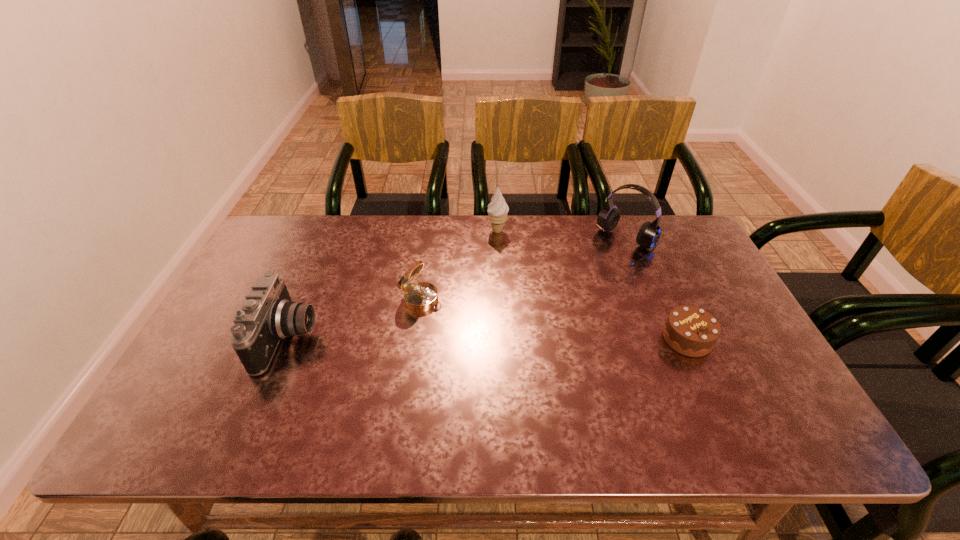
Image resolution: width=960 pixels, height=540 pixels. I want to click on free spot between the third object from left to right and the headset, so click(x=563, y=239).

Identify which object is located as the nearest to the third object from left to right. Please provide its 2D coordinates. Your answer should be formatted as a tuple, i.e. [(x, y)], where the tuple contains the x and y coordinates of a point satisfying the conditions above.

[(421, 296)]

Identify the location of object that is the closest to the second object from left to right. The image size is (960, 540). (267, 315).

Locate an element on the screen. The height and width of the screenshot is (540, 960). vacant area in the image that satisfies the following two spatial constraints: 1. on the front side of the headset; 2. on the right side of the icecream is located at coordinates (498, 246).

Find the location of `free space in the image that satisfies the following two spatial constraints: 1. on the back side of the compass; 2. on the right side of the icecream`. free space in the image that satisfies the following two spatial constraints: 1. on the back side of the compass; 2. on the right side of the icecream is located at coordinates (431, 231).